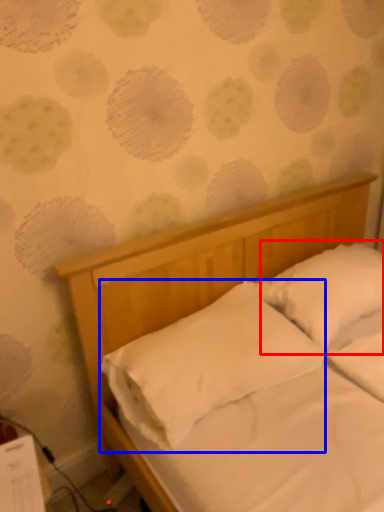
Question: Which of the following is the farthest to the observer, pillow (highlighted by a red box) or pillow (highlighted by a blue box)?

Choices:
 (A) pillow
 (B) pillow

Answer: (A)